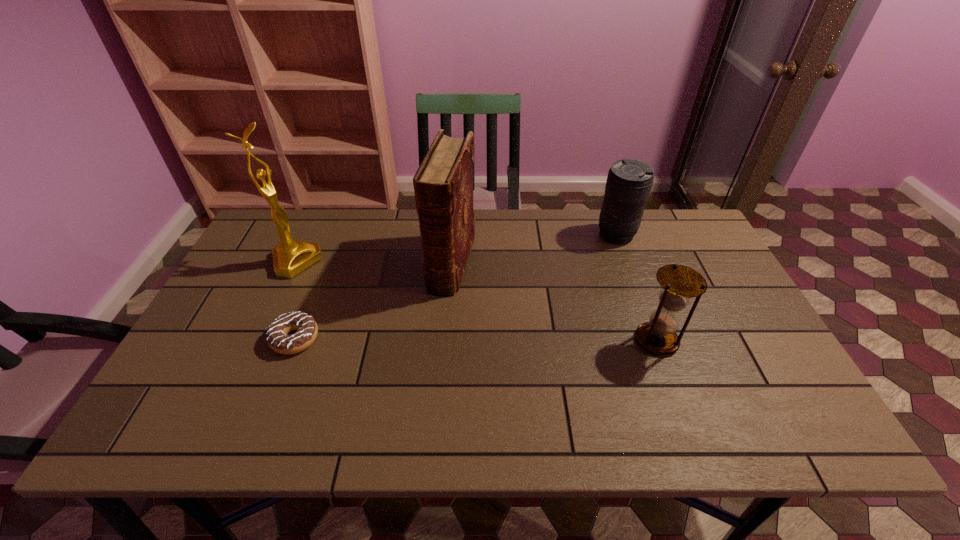
Find the location of a particular element. This screenshot has width=960, height=540. free spot between the hourglass and the doughnut is located at coordinates (476, 340).

Identify the location of free space between the doughnut and the hourglass. (476, 340).

Locate an element on the screen. This screenshot has height=540, width=960. vacant space that's between the hourglass and the award is located at coordinates (476, 301).

You are a GUI agent. You are given a task and a screenshot of the screen. Output one action in this format:
    pyautogui.click(x=<x>, y=<y>)
    Task: Click on the empty space that is in between the award and the fourth shortest object
    The height and width of the screenshot is (540, 960).
    Given the screenshot: What is the action you would take?
    pyautogui.click(x=373, y=263)

Identify the location of object that is the second closest to the hardback book. Image resolution: width=960 pixels, height=540 pixels. (290, 257).

You are a GUI agent. You are given a task and a screenshot of the screen. Output one action in this format:
    pyautogui.click(x=<x>, y=<y>)
    Task: Click on the object that ranks as the third closest to the shortest object
    This screenshot has height=540, width=960.
    Given the screenshot: What is the action you would take?
    pyautogui.click(x=679, y=283)

This screenshot has width=960, height=540. I want to click on vacant space that satisfies the following two spatial constraints: 1. on the back side of the doughnut; 2. on the left side of the third object from right to left, so click(324, 263).

I want to click on free spot that satisfies the following two spatial constraints: 1. on the front side of the award; 2. on the left side of the second tallest object, so click(x=296, y=263).

At what (x,y) coordinates should I click in order to perform the action: click on free point that satisfies the following two spatial constraints: 1. on the front side of the doughnut; 2. on the right side of the hourglass. Please return your answer as a coordinate pair (x, y). The width and height of the screenshot is (960, 540). Looking at the image, I should click on (295, 340).

Find the location of a particular element. The width and height of the screenshot is (960, 540). vacant space that satisfies the following two spatial constraints: 1. on the front side of the third object from left to right; 2. on the left side of the hourglass is located at coordinates (446, 340).